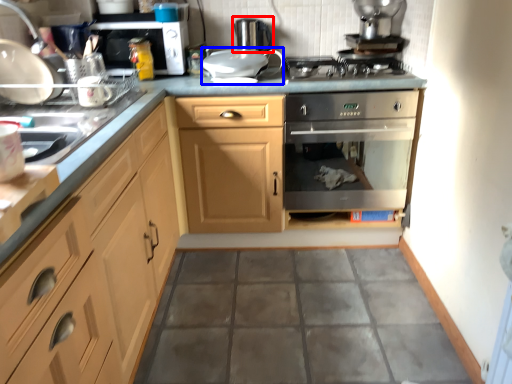
Question: Which object appears closest to the camera in this image, appliance (highlighted by a red box) or appliance (highlighted by a blue box)?

Choices:
 (A) appliance
 (B) appliance

Answer: (B)